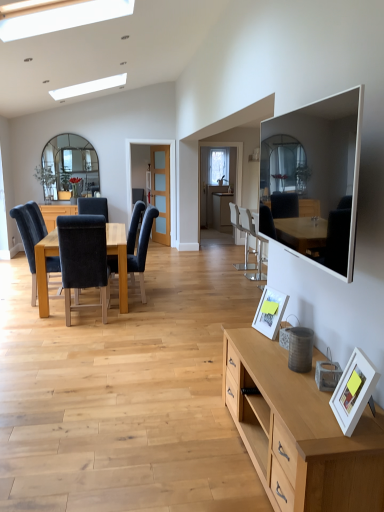
What do you see at coordinates (257, 240) in the screenshot? I see `metallic silver bar stool at center, the 1th chair viewed from the right` at bounding box center [257, 240].

You are a GUI agent. You are given a task and a screenshot of the screen. Output one action in this format:
    pyautogui.click(x=<x>, y=<y>)
    Task: Click on the white matte picture frame at lower right, the 2th picture frame positioned from the right
    The width and height of the screenshot is (384, 512).
    Given the screenshot: What is the action you would take?
    (x=270, y=312)

Describe the element at coordinates (161, 192) in the screenshot. I see `clear glass door at center` at that location.

Locate an element on the screen. velvet black chair at left, which is the second chair in left-to-right order is located at coordinates (83, 259).

Image resolution: width=384 pixels, height=512 pixels. Describe the element at coordinates (83, 259) in the screenshot. I see `velvet black chair at left, marked as the 4th chair in a right-to-left arrangement` at that location.

Describe the element at coordinates (93, 206) in the screenshot. Image resolution: width=384 pixels, height=512 pixels. I see `velvet dark blue chair at center left, the 1th chair positioned from the left` at that location.

Identify the location of white glossy mirror at upper right. 314,181.

Is white matte picture frame at lower right, which is the first picture frame in left-to-right order, facing away from velvet dark blue chair at center left, the 1th chair positioned from the left?

That's not correct — white matte picture frame at lower right, which is the first picture frame in left-to-right order, is not looking away from velvet dark blue chair at center left, the 1th chair positioned from the left.

How far apart are white matte picture frame at lower right, arranged as the second picture frame when viewed from the front, and velvet dark blue chair at center left, arranged as the fourth chair when viewed from the front?

white matte picture frame at lower right, arranged as the second picture frame when viewed from the front, is 3.84 meters from velvet dark blue chair at center left, arranged as the fourth chair when viewed from the front.

Consider the image. Considering the relative sizes of white matte picture frame at lower right, which is the first picture frame in left-to-right order, and velvet dark blue chair at center left, arranged as the 5th chair when viewed from the right, in the image provided, is white matte picture frame at lower right, which is the first picture frame in left-to-right order, bigger than velvet dark blue chair at center left, arranged as the 5th chair when viewed from the right,?

Actually, white matte picture frame at lower right, which is the first picture frame in left-to-right order, might be smaller than velvet dark blue chair at center left, arranged as the 5th chair when viewed from the right.

Which chair is the 4th one when counting from the back of the white matte picture frame at lower right, which is the first picture frame in left-to-right order? Please provide its 2D coordinates.

[(93, 206)]

Which object is wider, velvet black chair at left, marked as the 4th chair in a right-to-left arrangement, or velvet dark blue chair at center left, acting as the 2th chair starting from the back?

velvet black chair at left, marked as the 4th chair in a right-to-left arrangement, is wider.

Could velvet dark blue chair at center left, arranged as the fourth chair when viewed from the front, be considered to be inside velvet black chair at left, marked as the 4th chair in a right-to-left arrangement?

Actually, velvet dark blue chair at center left, arranged as the fourth chair when viewed from the front, is outside velvet black chair at left, marked as the 4th chair in a right-to-left arrangement.

Can you see velvet black chair at left, which is counted as the 5th chair, starting from the back, touching velvet dark blue chair at center left, the 1th chair positioned from the left?

No, velvet black chair at left, which is counted as the 5th chair, starting from the back, is not touching velvet dark blue chair at center left, the 1th chair positioned from the left.

Can you tell me how much velvet black chair at left, marked as the 4th chair in a right-to-left arrangement, and velvet dark blue chair at center left, arranged as the fourth chair when viewed from the front, differ in facing direction?

The angular difference between velvet black chair at left, marked as the 4th chair in a right-to-left arrangement, and velvet dark blue chair at center left, arranged as the fourth chair when viewed from the front, is 178 degrees.

Could you tell me if velvet dark blue chair at center left, the 1th chair positioned from the left, is facing clear glass door at center?

No, velvet dark blue chair at center left, the 1th chair positioned from the left, is not facing towards clear glass door at center.

From the image's perspective, is velvet dark blue chair at center left, the 1th chair positioned from the left, positioned above or below clear glass door at center?

velvet dark blue chair at center left, the 1th chair positioned from the left, is situated lower than clear glass door at center in the image.

Can you tell me how much velvet dark blue chair at center left, arranged as the fourth chair when viewed from the front, and clear glass door at center differ in facing direction?

69.3 degrees separate the facing orientations of velvet dark blue chair at center left, arranged as the fourth chair when viewed from the front, and clear glass door at center.

Is velvet dark blue chair at center left, acting as the 2th chair starting from the back, located outside clear glass door at center?

Indeed, velvet dark blue chair at center left, acting as the 2th chair starting from the back, is completely outside clear glass door at center.

Does velvet black chair at left, marked as the 4th chair in a right-to-left arrangement, have a greater width compared to metallic silver bar stool at center, the 3th chair in the front-to-back sequence?

Yes, velvet black chair at left, marked as the 4th chair in a right-to-left arrangement, is wider than metallic silver bar stool at center, the 3th chair in the front-to-back sequence.

From a real-world perspective, is velvet black chair at left, which is the second chair in left-to-right order, located higher than metallic silver bar stool at center, the third chair when ordered from back to front?

Yes, from a real-world perspective, velvet black chair at left, which is the second chair in left-to-right order, is on top of metallic silver bar stool at center, the third chair when ordered from back to front.

Considering the points (102, 259) and (246, 226), which point is behind, point (102, 259) or point (246, 226)?

The point (246, 226) is farther.

Does velvet black chair at left, acting as the 1th chair starting from the front, have a smaller size compared to metallic silver bar stool at center, the third chair when ordered from back to front?

Actually, velvet black chair at left, acting as the 1th chair starting from the front, might be larger than metallic silver bar stool at center, the third chair when ordered from back to front.

Starting from the white glossy mirror at upper right, which chair is the 1st one behind? Please provide its 2D coordinates.

[(83, 259)]

Does velvet black chair at left, marked as the 4th chair in a right-to-left arrangement, have a smaller size compared to white glossy mirror at upper right?

No, velvet black chair at left, marked as the 4th chair in a right-to-left arrangement, is not smaller than white glossy mirror at upper right.

Considering their positions, is velvet black chair at left, marked as the 4th chair in a right-to-left arrangement, located in front of or behind white glossy mirror at upper right?

In the image, velvet black chair at left, marked as the 4th chair in a right-to-left arrangement, appears behind white glossy mirror at upper right.

Is velvet dark blue chair at center left, acting as the 2th chair starting from the back, far away from velvet dark blue chair at center left, arranged as the 2th chair when viewed from the front?

Yes, velvet dark blue chair at center left, acting as the 2th chair starting from the back, and velvet dark blue chair at center left, arranged as the 2th chair when viewed from the front, are located far from each other.

Based on their sizes in the image, would you say velvet dark blue chair at center left, the 1th chair positioned from the left, is bigger or smaller than velvet dark blue chair at center left, which ranks as the fourth chair in back-to-front order?

Considering their sizes, velvet dark blue chair at center left, the 1th chair positioned from the left, takes up less space than velvet dark blue chair at center left, which ranks as the fourth chair in back-to-front order.

Which object is further away from the camera, velvet dark blue chair at center left, acting as the 2th chair starting from the back, or velvet dark blue chair at center left, arranged as the 2th chair when viewed from the front?

velvet dark blue chair at center left, acting as the 2th chair starting from the back, is more distant.

The height and width of the screenshot is (512, 384). I want to click on the 2nd chair behind the velvet dark blue chair at center left, the third chair when ordered from right to left, so click(x=93, y=206).

Can you tell me how much velvet dark blue chair at center left, the third chair when ordered from right to left, and metallic silver bar stool at center, which ranks as the fifth chair in left-to-right order, differ in facing direction?

179 degrees separate the facing orientations of velvet dark blue chair at center left, the third chair when ordered from right to left, and metallic silver bar stool at center, which ranks as the fifth chair in left-to-right order.

From the image's perspective, who appears lower, velvet dark blue chair at center left, the third chair when ordered from right to left, or metallic silver bar stool at center, the third chair when ordered from back to front?

velvet dark blue chair at center left, the third chair when ordered from right to left, from the image's perspective.

From the picture: Is velvet dark blue chair at center left, the third chair when ordered from right to left, smaller than metallic silver bar stool at center, the 3th chair in the front-to-back sequence?

Actually, velvet dark blue chair at center left, the third chair when ordered from right to left, might be larger than metallic silver bar stool at center, the 3th chair in the front-to-back sequence.

Identify the location of the 1st chair behind the velvet dark blue chair at center left, the third chair when ordered from right to left, counting from the anchor's position. (257, 240).

The width and height of the screenshot is (384, 512). Identify the location of picture frame that is the 1st one when counting downward from the velvet dark blue chair at center left, acting as the 2th chair starting from the back (from the image's perspective). [x=270, y=312].

Identify the location of chair located on the left of velvet black chair at left, acting as the 1th chair starting from the front. This screenshot has width=384, height=512. (93, 206).

From the image, which object appears to be nearer to white matte picture frame at lower right, arranged as the second picture frame when viewed from the front, velvet dark blue chair at center left, acting as the 2th chair starting from the back, or white matte picture frame at lower right, which is the second picture frame from back to front?

white matte picture frame at lower right, which is the second picture frame from back to front, is positioned closer to the anchor white matte picture frame at lower right, arranged as the second picture frame when viewed from the front.

When comparing their distances from white matte picture frame at lower right, which is the second picture frame from back to front, does clear glass door at center or white glossy mirror at upper right seem closer?

Based on the image, white glossy mirror at upper right appears to be nearer to white matte picture frame at lower right, which is the second picture frame from back to front.

Based on the photo, looking at the image, which one is located closer to velvet black chair at left, which is counted as the 5th chair, starting from the back, white plastic chair at center, which appears as the 5th chair when viewed from the front, or white glossy mirror at upper right?

white glossy mirror at upper right.

Estimate the real-world distances between objects in this image. Which object is further from clear glass door at center, white matte picture frame at lower right, acting as the 2th picture frame starting from the left, or white plastic chair at center, which is the 1th chair from back to front?

The object further to clear glass door at center is white matte picture frame at lower right, acting as the 2th picture frame starting from the left.

From the image, which object appears to be farther from clear glass door at center, velvet dark blue chair at center left, the third chair when ordered from right to left, or white glossy mirror at upper right?

white glossy mirror at upper right is further to clear glass door at center.

From the image, which object appears to be farther from white glossy mirror at upper right, metallic silver bar stool at center, the 3th chair in the front-to-back sequence, or white matte picture frame at lower right, which is the second picture frame from back to front?

metallic silver bar stool at center, the 3th chair in the front-to-back sequence, is further to white glossy mirror at upper right.

Looking at the image, which one is located closer to white plastic chair at center, which is the 1th chair from back to front, metallic silver bar stool at center, which ranks as the fifth chair in left-to-right order, or velvet black chair at left, marked as the 4th chair in a right-to-left arrangement?

Among the two, metallic silver bar stool at center, which ranks as the fifth chair in left-to-right order, is located nearer to white plastic chair at center, which is the 1th chair from back to front.

Estimate the real-world distances between objects in this image. Which object is closer to white matte picture frame at lower right, which is the first picture frame in left-to-right order, metallic silver bar stool at center, the 1th chair viewed from the right, or clear glass door at center?

metallic silver bar stool at center, the 1th chair viewed from the right, lies closer to white matte picture frame at lower right, which is the first picture frame in left-to-right order, than the other object.

At what (x,y) coordinates should I click in order to perform the action: click on picture frame located between white matte picture frame at lower right, the 1th picture frame in the right-to-left sequence, and velvet black chair at left, which is the second chair in left-to-right order, in the depth direction. Please return your answer as a coordinate pair (x, y). Looking at the image, I should click on (270, 312).

You are a GUI agent. You are given a task and a screenshot of the screen. Output one action in this format:
    pyautogui.click(x=<x>, y=<y>)
    Task: Click on the chair between velvet dark blue chair at center left, the 1th chair positioned from the left, and clear glass door at center in the front-back direction
    Image resolution: width=384 pixels, height=512 pixels.
    Given the screenshot: What is the action you would take?
    pyautogui.click(x=245, y=237)

Locate an element on the screen. picture frame positioned between white matte picture frame at lower right, which appears as the 1th picture frame when viewed from the front, and velvet dark blue chair at center left, the 1th chair positioned from the left, from near to far is located at coordinates (270, 312).

Find the location of a particular element. picture frame located between white matte picture frame at lower right, the 1th picture frame in the right-to-left sequence, and white plastic chair at center, the fourth chair from the left, in the depth direction is located at coordinates (270, 312).